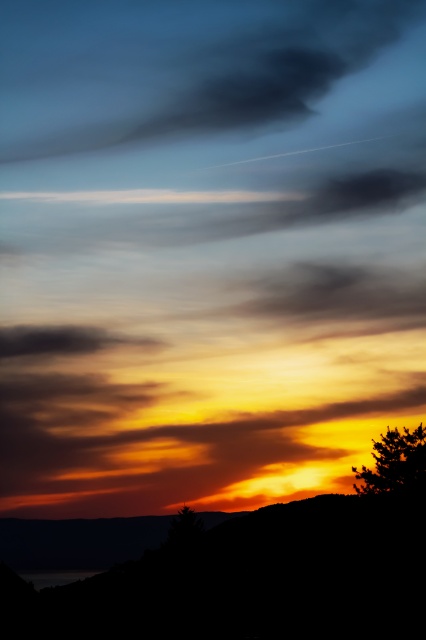
You are a GUI agent. You are given a task and a screenshot of the screen. Output one action in this format:
    pyautogui.click(x=<x>, y=<y>)
    Task: Click on the silhouette hillside at lower left
    The width and height of the screenshot is (426, 640).
    Given the screenshot: What is the action you would take?
    (250, 580)

Does silhouette hillside at lower left have a larger size compared to silhouette tree at lower right?

Indeed, silhouette hillside at lower left has a larger size compared to silhouette tree at lower right.

Between point (417, 529) and point (389, 432), which one is positioned in front?

Positioned in front is point (417, 529).

Locate an element on the screen. silhouette hillside at lower left is located at coordinates (250, 580).

Image resolution: width=426 pixels, height=640 pixels. Describe the element at coordinates (175, 67) in the screenshot. I see `dark gray cloud at upper center` at that location.

Does dark gray cloud at upper center appear over silhouette tree at lower right?

Indeed, dark gray cloud at upper center is positioned over silhouette tree at lower right.

Is point (166, 65) positioned in front of point (423, 445)?

No.

Find the location of a particular element. This screenshot has height=640, width=426. dark gray cloud at upper center is located at coordinates (175, 67).

Does smokey gray cloud at upper center have a smaller size compared to dark matte cloud at center?

No.

Does point (189, 196) lie behind point (25, 333)?

Yes, it is.

In order to click on smokey gray cloud at upper center in this screenshot , I will do `click(209, 209)`.